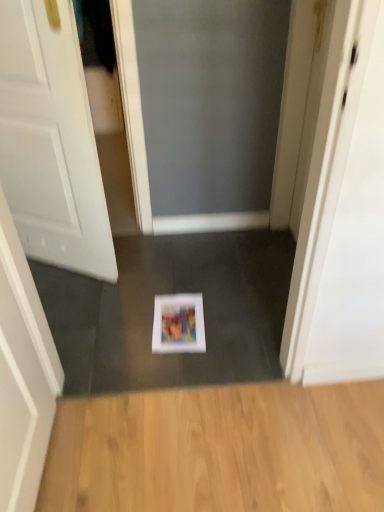
Question: From the image's perspective, is white matte door at center below white glossy screen door at upper right?

Choices:
 (A) yes
 (B) no

Answer: (A)

Question: Is white matte door at center behind white glossy screen door at upper right?

Choices:
 (A) yes
 (B) no

Answer: (B)

Question: Does white matte door at center contain white glossy screen door at upper right?

Choices:
 (A) yes
 (B) no

Answer: (B)

Question: Does white matte door at center have a greater width compared to white glossy screen door at upper right?

Choices:
 (A) yes
 (B) no

Answer: (B)

Question: Considering the relative sizes of white matte door at center and white glossy screen door at upper right in the image provided, is white matte door at center thinner than white glossy screen door at upper right?

Choices:
 (A) yes
 (B) no

Answer: (A)

Question: From a real-world perspective, is white matte door at center below white glossy screen door at upper right?

Choices:
 (A) no
 (B) yes

Answer: (A)

Question: Can you confirm if white glossy screen door at upper right is taller than matte paper magazine at center?

Choices:
 (A) no
 (B) yes

Answer: (B)

Question: Can you confirm if white glossy screen door at upper right is positioned to the left of matte paper magazine at center?

Choices:
 (A) yes
 (B) no

Answer: (B)

Question: From a real-world perspective, is white glossy screen door at upper right positioned over matte paper magazine at center based on gravity?

Choices:
 (A) yes
 (B) no

Answer: (A)

Question: Does white glossy screen door at upper right have a lesser height compared to matte paper magazine at center?

Choices:
 (A) no
 (B) yes

Answer: (A)

Question: From a real-world perspective, does white glossy screen door at upper right sit lower than matte paper magazine at center?

Choices:
 (A) yes
 (B) no

Answer: (B)

Question: From the image's perspective, does white glossy screen door at upper right appear lower than matte paper magazine at center?

Choices:
 (A) yes
 (B) no

Answer: (B)

Question: Is light brown wood flooring at lower center facing away from white glossy screen door at upper right?

Choices:
 (A) yes
 (B) no

Answer: (B)